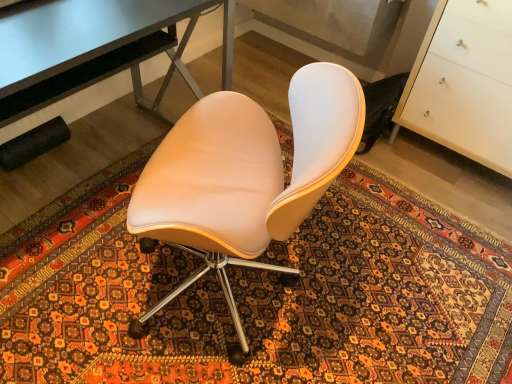
Question: Is white glossy cabinet at right not inside matte beige chair at center?

Choices:
 (A) yes
 (B) no

Answer: (A)

Question: From the image's perspective, is white glossy cabinet at right beneath matte beige chair at center?

Choices:
 (A) yes
 (B) no

Answer: (B)

Question: Is white glossy cabinet at right facing towards matte beige chair at center?

Choices:
 (A) no
 (B) yes

Answer: (B)

Question: Is white glossy cabinet at right not close to matte beige chair at center?

Choices:
 (A) no
 (B) yes

Answer: (B)

Question: Are white glossy cabinet at right and matte beige chair at center beside each other?

Choices:
 (A) no
 (B) yes

Answer: (A)

Question: Does white glossy cabinet at right come behind matte beige chair at center?

Choices:
 (A) yes
 (B) no

Answer: (A)

Question: Is patterned carpet at center next to matte beige chair at center and touching it?

Choices:
 (A) no
 (B) yes

Answer: (A)

Question: From a real-world perspective, is patterned carpet at center on matte beige chair at center?

Choices:
 (A) no
 (B) yes

Answer: (A)

Question: Would you say patterned carpet at center contains matte beige chair at center?

Choices:
 (A) no
 (B) yes

Answer: (A)

Question: Is patterned carpet at center at the left side of matte beige chair at center?

Choices:
 (A) no
 (B) yes

Answer: (A)

Question: Can you confirm if patterned carpet at center is taller than matte beige chair at center?

Choices:
 (A) yes
 (B) no

Answer: (B)

Question: Can you confirm if patterned carpet at center is smaller than matte beige chair at center?

Choices:
 (A) yes
 (B) no

Answer: (A)

Question: Considering the relative sizes of matte beige chair at center and metallic gray desk at upper left in the image provided, is matte beige chair at center thinner than metallic gray desk at upper left?

Choices:
 (A) no
 (B) yes

Answer: (A)